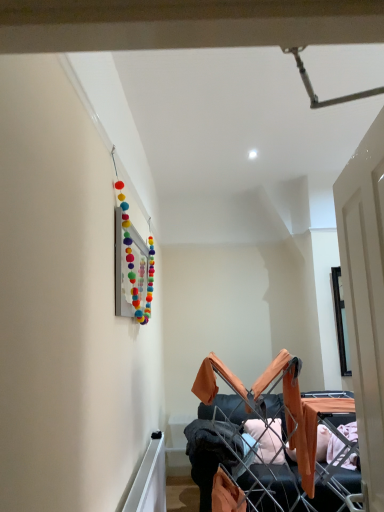
Question: Considering the relative positions of orange fabric drying rack at lower right and dark gray fabric at center in the image provided, is orange fabric drying rack at lower right to the left of dark gray fabric at center from the viewer's perspective?

Choices:
 (A) no
 (B) yes

Answer: (A)

Question: Does orange fabric drying rack at lower right have a greater width compared to dark gray fabric at center?

Choices:
 (A) yes
 (B) no

Answer: (A)

Question: Is orange fabric drying rack at lower right at the right side of dark gray fabric at center?

Choices:
 (A) no
 (B) yes

Answer: (B)

Question: Does orange fabric drying rack at lower right have a greater height compared to dark gray fabric at center?

Choices:
 (A) yes
 (B) no

Answer: (A)

Question: Considering the relative sizes of orange fabric drying rack at lower right and dark gray fabric at center in the image provided, is orange fabric drying rack at lower right bigger than dark gray fabric at center?

Choices:
 (A) yes
 (B) no

Answer: (A)

Question: Are orange fabric drying rack at lower right and dark gray fabric at center beside each other?

Choices:
 (A) no
 (B) yes

Answer: (A)

Question: Is orange fabric drying rack at lower right to the left of white wooden door at right from the viewer's perspective?

Choices:
 (A) yes
 (B) no

Answer: (B)

Question: Is orange fabric drying rack at lower right positioned in front of white wooden door at right?

Choices:
 (A) no
 (B) yes

Answer: (A)

Question: Does orange fabric drying rack at lower right come behind white wooden door at right?

Choices:
 (A) no
 (B) yes

Answer: (B)

Question: From the image's perspective, is orange fabric drying rack at lower right on top of white wooden door at right?

Choices:
 (A) no
 (B) yes

Answer: (A)

Question: From the image's perspective, is orange fabric drying rack at lower right below white wooden door at right?

Choices:
 (A) yes
 (B) no

Answer: (A)

Question: Can you confirm if orange fabric drying rack at lower right is smaller than white wooden door at right?

Choices:
 (A) yes
 (B) no

Answer: (B)

Question: Is dark gray fabric at center located outside orange fabric drying rack at lower right?

Choices:
 (A) no
 (B) yes

Answer: (B)